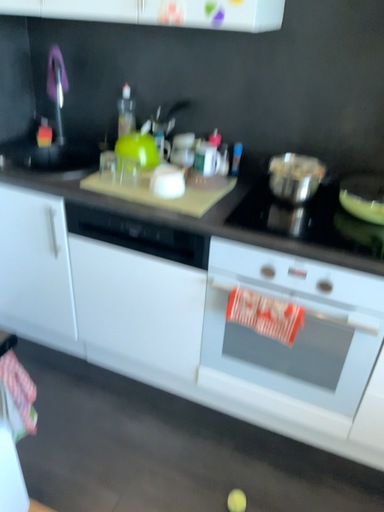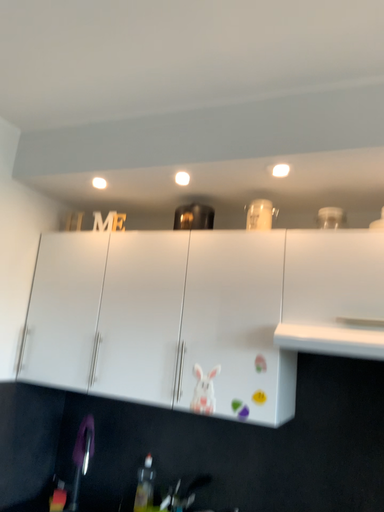
Question: Which way did the camera rotate in the video?

Choices:
 (A) rotated downward
 (B) rotated upward

Answer: (B)